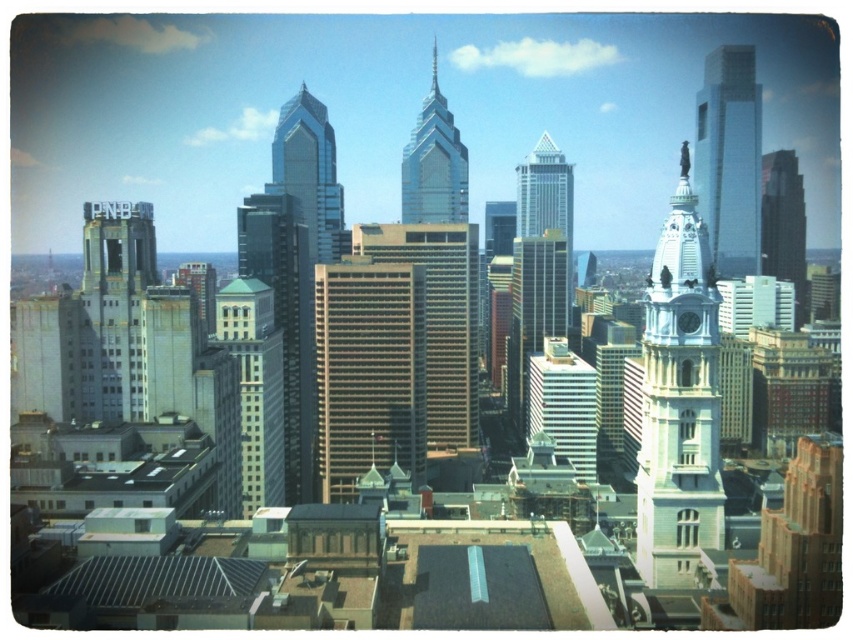
You are an architect analyzing the city skyline. You notice two skyscrapers at the center of the image. Which one is smaller in size between the gold reflective skyscraper at center and the silver glass skyscraper at center?

The gold reflective skyscraper at center is smaller in size compared to the silver glass skyscraper at center.